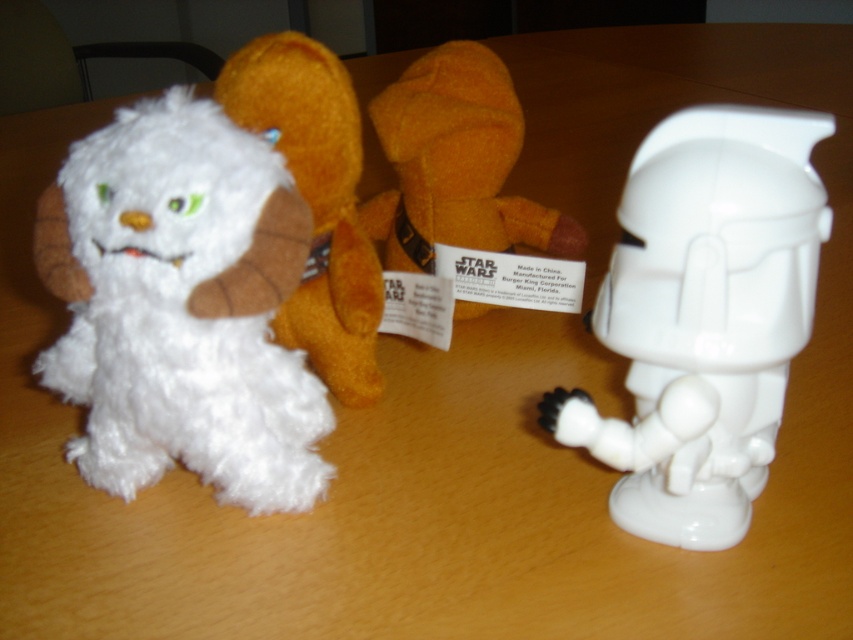
What is the spatial relationship between the white matte plastic stormtrooper at right and the other objects in the scene?

The white matte plastic stormtrooper at right is positioned at coordinates approximately 0.497 along the x and 0.825 along the y axis, making it the rightmost object in the scene.

You are a photographer setting up a tripod to capture the two plush toys on the wooden table. The first plush toy is at point (299, 230) and the second at point (646, 515). To ensure both are in focus, you need to know which toy is closer to the camera. Which point corresponds to the toy that is closer?

Point (299, 230) is closer to the viewer than point (646, 515), so the toy at point (299, 230) is closer to the camera.

You are organizing a toy store shelf and need to arrange the white fluffy stuffed animal at left and the white matte plastic stormtrooper at right. According to their positions, which toy should you place on the left side of the shelf?

The white fluffy stuffed animal at left should be placed on the left side of the shelf since it is already positioned to the left of the white matte plastic stormtrooper at right in the image.